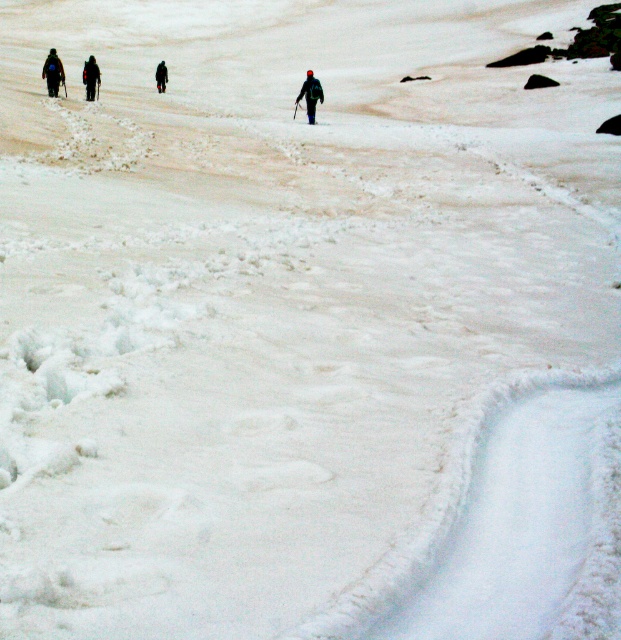
Does dark blue jacket at left appear over dark gray fabric jacket at center?

No.

Identify the location of dark blue jacket at left. The image size is (621, 640). (52, 72).

The image size is (621, 640). I want to click on dark blue jacket at left, so click(52, 72).

Does dark blue jacket at left have a greater width compared to dark blue jacket at center?

Yes, dark blue jacket at left is wider than dark blue jacket at center.

In the scene shown: Is dark blue jacket at left below dark blue jacket at center?

No, dark blue jacket at left is not below dark blue jacket at center.

Which is in front, point (45, 58) or point (306, 77)?

Point (306, 77) is in front.

Identify the location of dark blue jacket at left. This screenshot has width=621, height=640. (52, 72).

Between point (93, 92) and point (156, 72), which one is positioned behind?

The point (156, 72) is more distant.

Can you confirm if black fabric jacket at upper left is shorter than dark gray fabric jacket at center?

In fact, black fabric jacket at upper left may be taller than dark gray fabric jacket at center.

Does point (91, 67) come farther from viewer compared to point (161, 90)?

No, it is in front of (161, 90).

Identify the location of black fabric jacket at upper left. (91, 76).